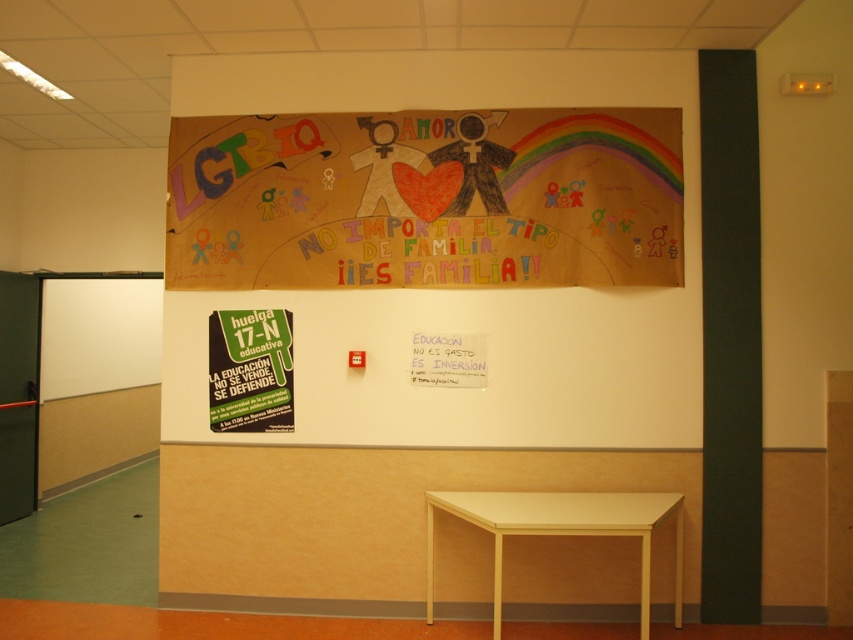
You are a student standing in the classroom and want to hang a new poster on the wall. The existing poster is at point (463, 289). If you want to place your new poster to the right of the existing one, where should you place it?

To place the new poster to the right of the existing one at point 0.454, 0.544, you should position it at a coordinate with a higher x value than 0.453, such as 0.550, 0.544.

You are a student who wants to hang a new poster on the wall where the cardboard banner at upper center and white paper at upper center are currently displayed. If you want to place your new poster above the existing items, where should you position it?

The cardboard banner at upper center is positioned over white paper at upper center, so to place your new poster above the existing items, you should position it above the cardboard banner at upper center.

You are standing in front of the classroom poster and notice two points marked on it. The first point is at coordinates point [202,81] and the second is at point [642,550]. Which point is closer to the bottom edge of the poster?

Point [642,550] is closer to the bottom edge of the poster because it has a higher y coordinate than point [202,81].